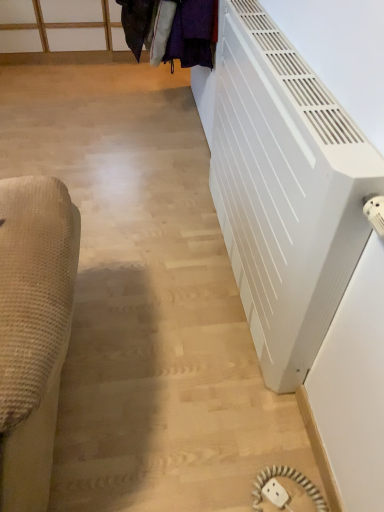
The height and width of the screenshot is (512, 384). Identify the location of vacant space that's between white matte radiator at right and white plastic outlet at lower right. (264, 399).